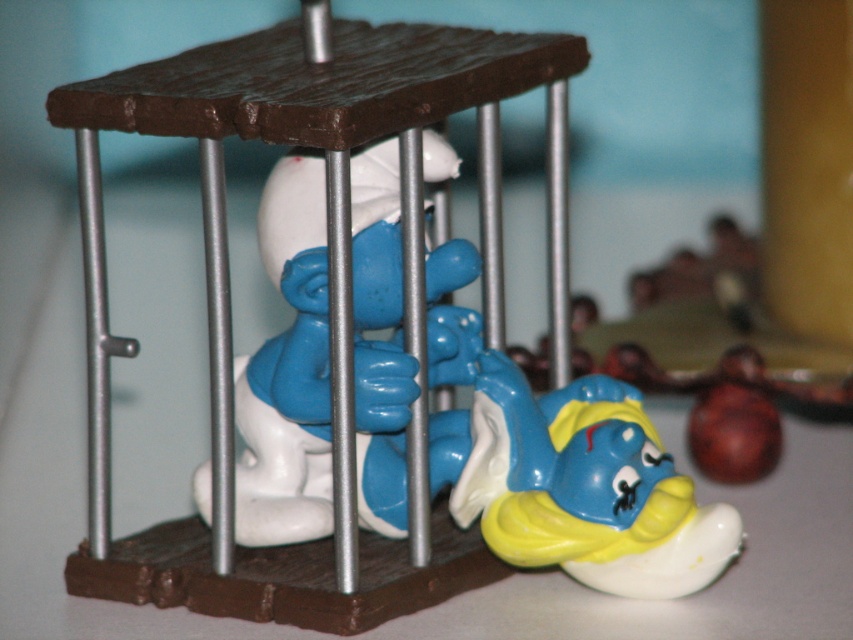
Based on the photo, in the image of the Smurf figurines scene, there is a blue plastic toy at center and a blue glossy smurf at lower right. Which object is positioned to the right side of the other?

The blue glossy smurf at lower right is positioned to the right of the blue plastic toy at center.

In the scene shown: You are holding a small toy that is 0.5 meters tall. You want to place it on the point at coordinates point (204, 465). Will the toy be visible to someone standing 1.5 meters away from that point?

The distance of point (204, 465) from viewer is 1.18 meters. Since the toy is placed on that point and the viewer is 1.5 meters away from the point, the total distance between the viewer and the toy would be 1.18 meters plus 1.5 meters, totaling 2.68 meters. However, visibility depends on factors like the toy size and the viewer angle, but based on distance alone, the toy might be visible but could appear small.

You are a child who found the blue plastic toy at center and the blue glossy smurf at lower right in a toy box. Which object is covering the other one?

The blue plastic toy at center is positioned over the blue glossy smurf at lower right, so the blue plastic toy at center is covering the blue glossy smurf at lower right.